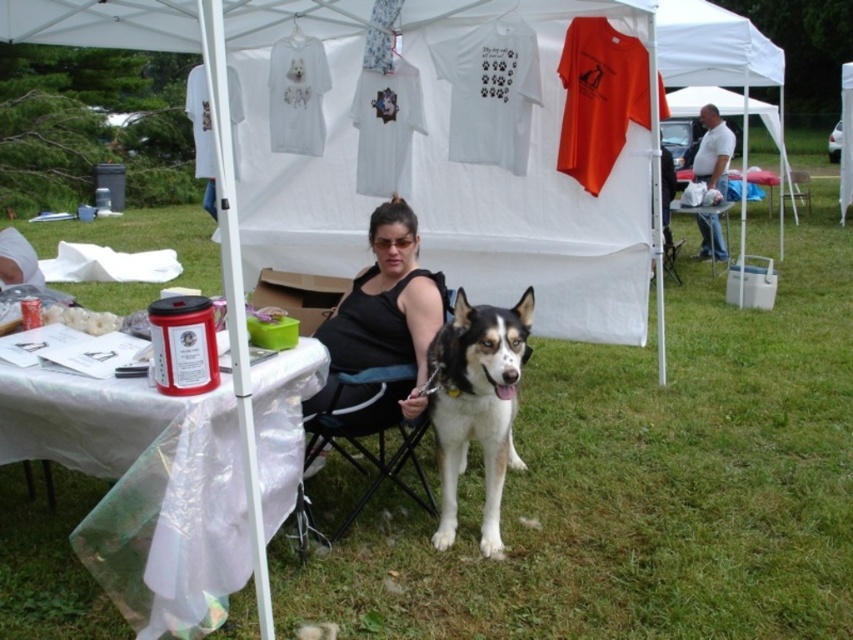
You are a customer at a pop up shop and you see the white fur dog at center and the white plastic table at center. Which object is taller?

The white fur dog at center is taller than the white plastic table at center.

You are standing in front of the table at the outdoor tent. There are two points marked on the table surface. One is at coordinates point (456, 337) and the other is at point (720, 196). Which point is closer to you?

Point (456, 337) is closer to the viewer than point (720, 196).

You are setting up a small stand and need to place a large display on the table. Which object, the white plastic table at lower left or the black fabric chair at center, can accommodate the display due to its larger width?

The white plastic table at lower left has a larger width than the black fabric chair at center, so it can accommodate the display.